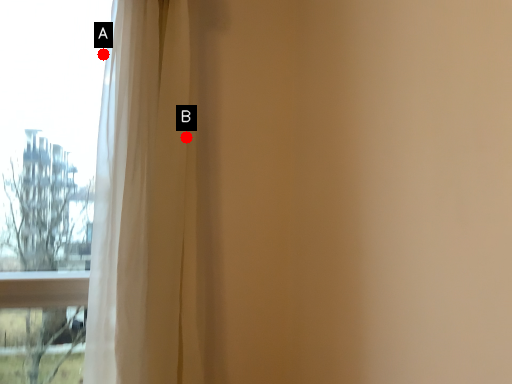
Question: Two points are circled on the image, labeled by A and B beside each circle. Which point appears farthest from the camera in this image?

Choices:
 (A) A is further
 (B) B is further

Answer: (A)